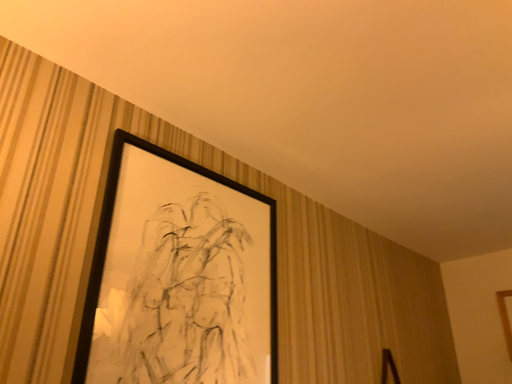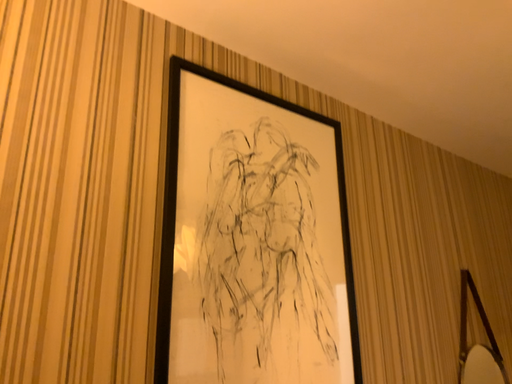
Question: Which way did the camera rotate in the video?

Choices:
 (A) rotated upward
 (B) rotated downward

Answer: (B)